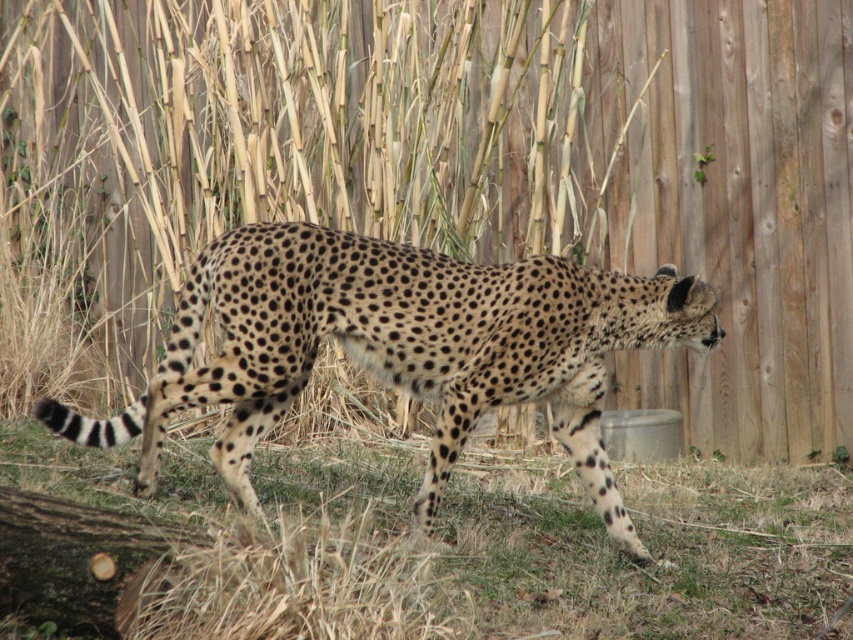
Question: Can you confirm if wooden fence at center is positioned below green grass at lower center?

Choices:
 (A) no
 (B) yes

Answer: (A)

Question: Where is wooden fence at center located in relation to spotted fur cheetah at center in the image?

Choices:
 (A) left
 (B) right

Answer: (B)

Question: Which object is closer to the camera taking this photo?

Choices:
 (A) spotted fur cheetah at center
 (B) green grass at lower center

Answer: (B)

Question: Estimate the real-world distances between objects in this image. Which object is closer to the spotted fur cheetah at center?

Choices:
 (A) green grass at lower center
 (B) wooden fence at center

Answer: (A)

Question: Is wooden fence at center positioned before green grass at lower center?

Choices:
 (A) no
 (B) yes

Answer: (A)

Question: Which object is farther from the camera taking this photo?

Choices:
 (A) spotted fur cheetah at center
 (B) green grass at lower center
 (C) wooden fence at center

Answer: (C)